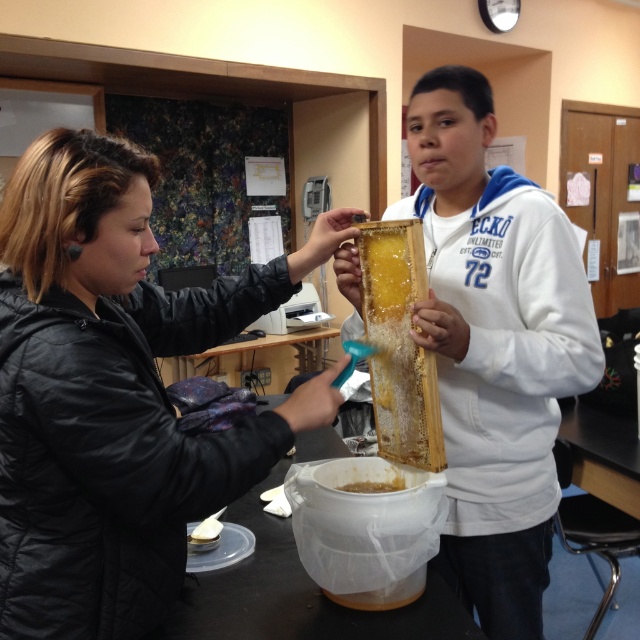
You are a beekeeper standing in the workshop and need to reach the telephone on the wall. The black matte jacket at left is blocking your path. Can you step around the jacket without moving it? Please explain why.

The black matte jacket at left and viewer are 31.61 inches apart from each other. Since the jacket is part of the person on the left, you cannot step around it without moving the person, so you must ask them to move first.

You are a beekeeper observing the scene. You need to reach the yellow translucent honeycomb at center to collect honey. Is the black matte jacket at left in your way?

The black matte jacket at left is above the yellow translucent honeycomb at center, so it is not blocking your path to reach the honeycomb.